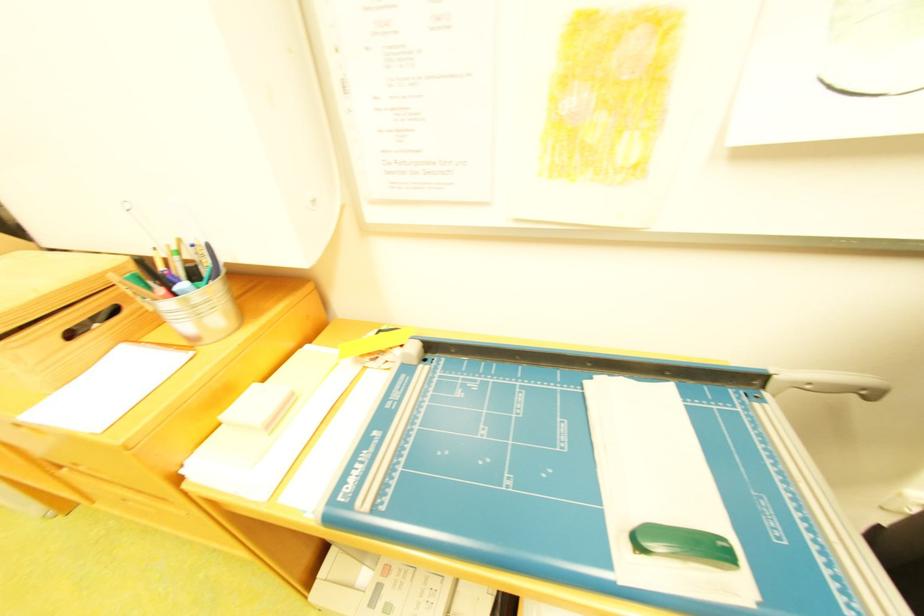
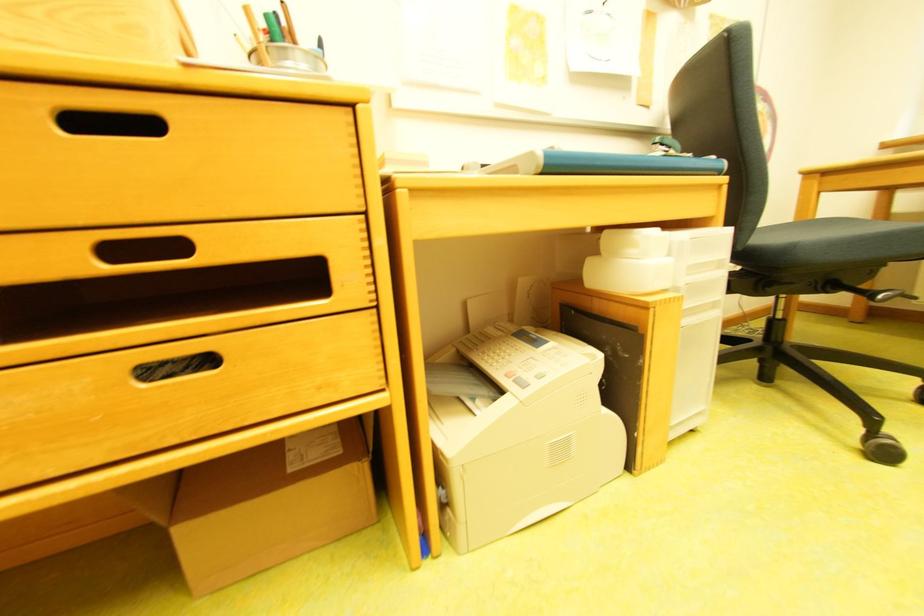
Find the pixel in the second image that matches point 395,588 in the first image.

(531, 378)